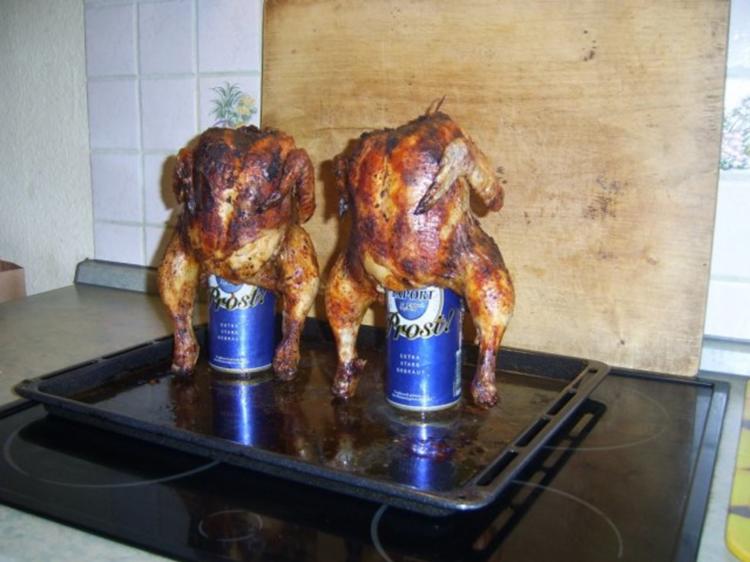
What are the coordinates of `stove` in the screenshot? It's located at (604, 430).